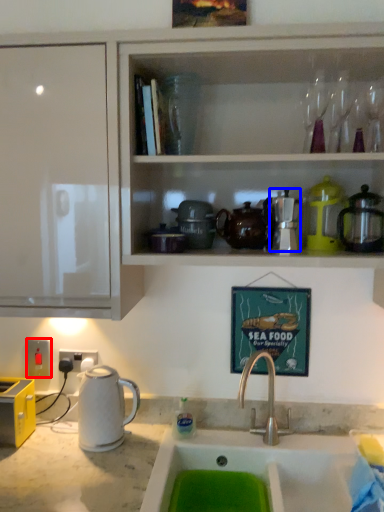
Question: Among these objects, which one is farthest to the camera, electric outlet (highlighted by a red box) or appliance (highlighted by a blue box)?

Choices:
 (A) electric outlet
 (B) appliance

Answer: (A)